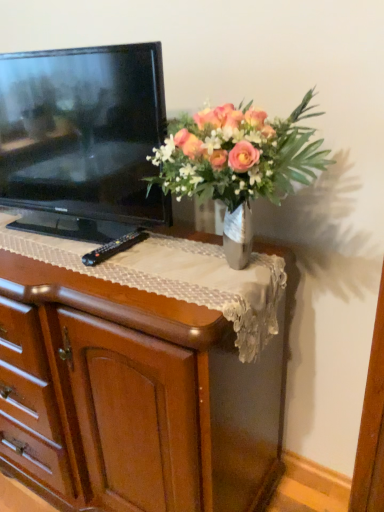
Question: Is point (79, 113) positioned closer to the camera than point (256, 185)?

Choices:
 (A) farther
 (B) closer

Answer: (A)

Question: From a real-world perspective, relative to metallic vase at upper center, is black glossy television at left vertically above or below?

Choices:
 (A) above
 (B) below

Answer: (A)

Question: Considering the real-world distances, which object is closest to the wooden chest of drawers at center?

Choices:
 (A) black plastic remote at center
 (B) metallic vase at upper center
 (C) black glossy television at left

Answer: (C)

Question: Which of these objects is positioned closest to the wooden chest of drawers at center?

Choices:
 (A) black glossy television at left
 (B) metallic vase at upper center
 (C) black plastic remote at center

Answer: (A)